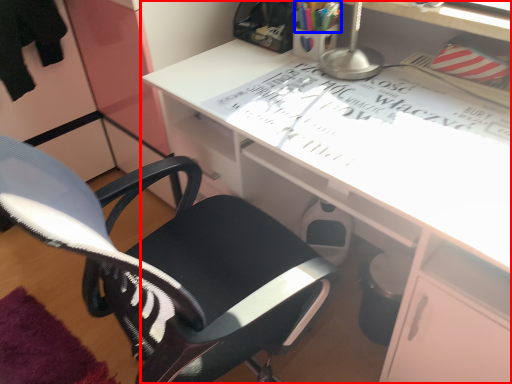
Question: Which object appears closest to the camera in this image, desk (highlighted by a red box) or stationery (highlighted by a blue box)?

Choices:
 (A) desk
 (B) stationery

Answer: (A)